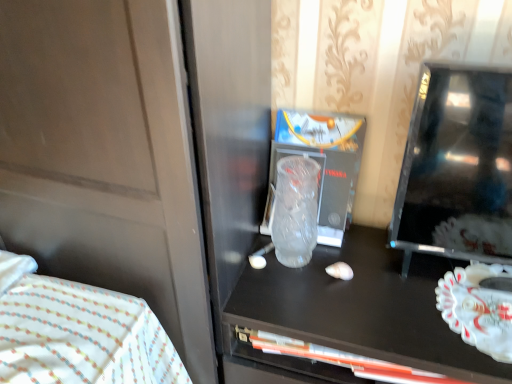
Identify the location of vacant space situated above white fabric bed at lower left (from a real-world perspective). Image resolution: width=512 pixels, height=384 pixels. (51, 328).